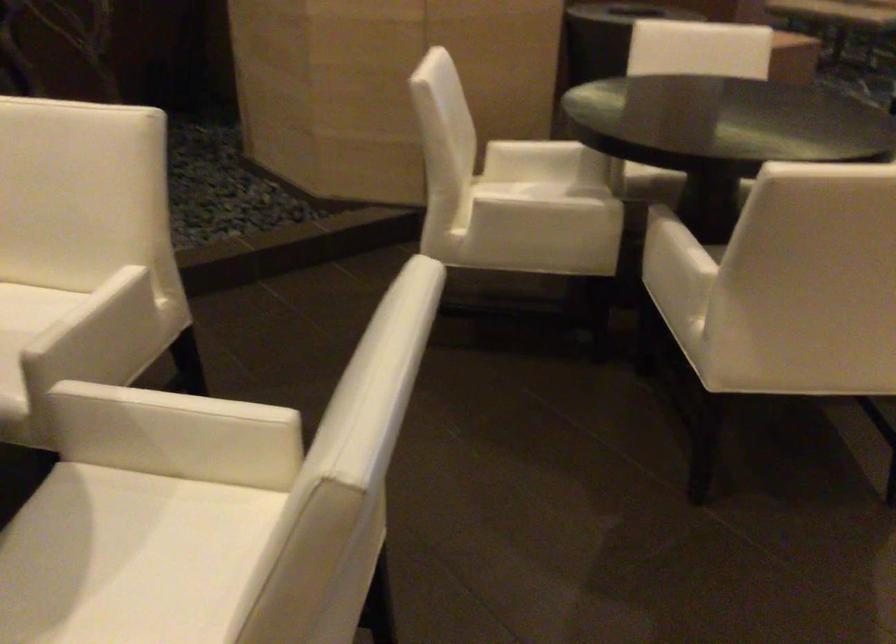
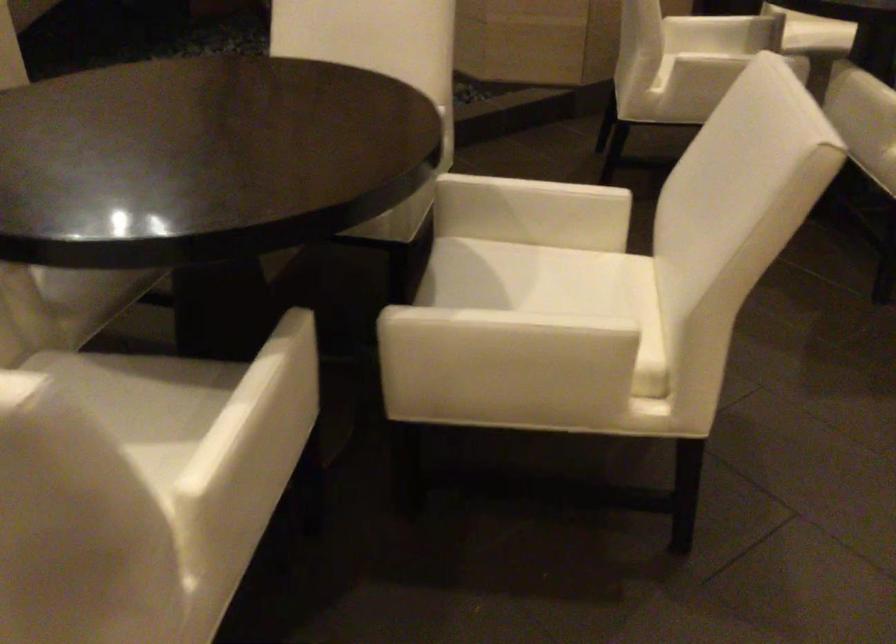
Where in the second image is the point corresponding to pixel 522 220 from the first image?

(726, 60)